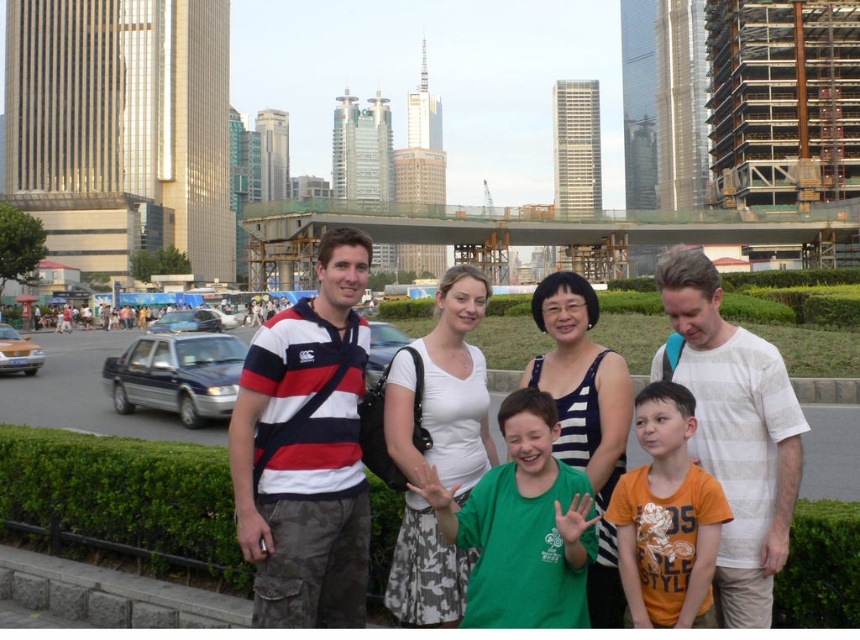
Question: Among these objects, which one is farthest from the camera?

Choices:
 (A) orange cotton shirt at center
 (B) striped cotton shirt at center
 (C) green matte shirt at center

Answer: (B)

Question: Does striped cotton shirt at center have a larger size compared to shiny silver sedan at center-left?

Choices:
 (A) yes
 (B) no

Answer: (B)

Question: Estimate the real-world distances between objects in this image. Which object is farther from the shiny silver sedan at left?

Choices:
 (A) yellow matte taxi at left
 (B) white cotton shirt at center
 (C) green matte shirt at center

Answer: (C)

Question: Which of the following is the farthest from the observer?

Choices:
 (A) orange cotton shirt at center
 (B) metallic blue sedan at left
 (C) shiny silver sedan at left

Answer: (C)

Question: From the image, what is the correct spatial relationship of green matte shirt at center in relation to shiny silver sedan at center?

Choices:
 (A) below
 (B) above

Answer: (A)

Question: Does striped cotton shirt at center have a greater width compared to metallic blue sedan at left?

Choices:
 (A) yes
 (B) no

Answer: (B)